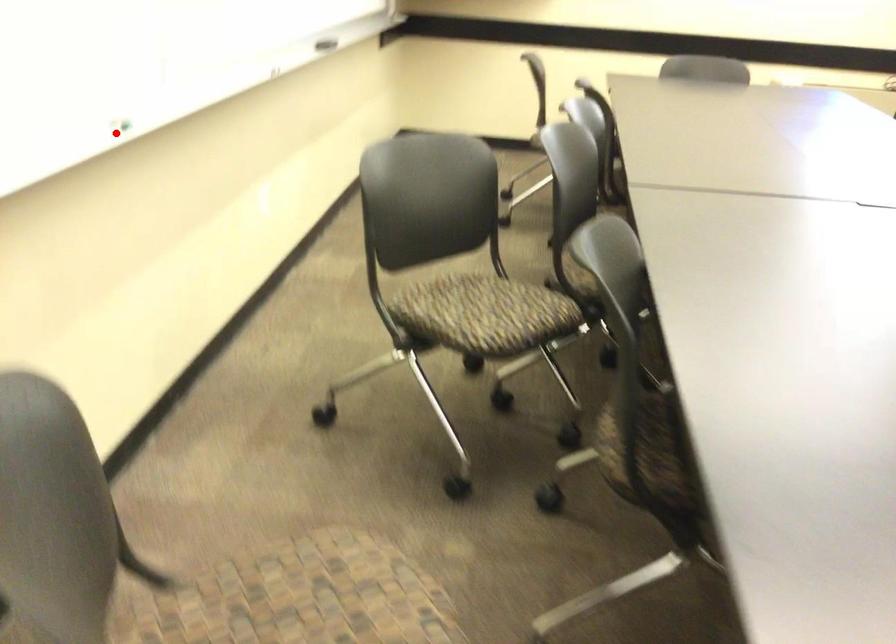
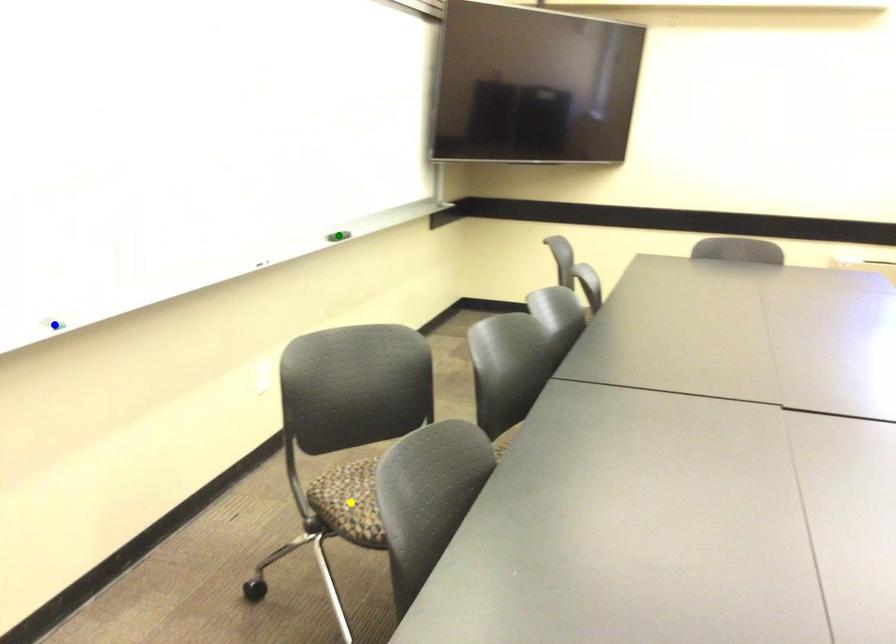
Question: I am providing you with two images of the same scene from different viewpoints. A red point is marked on the first image. You are given multiple points on the second image. Can you choose the point in image 2 that corresponds to the point in image 1?

Choices:
 (A) blue point
 (B) green point
 (C) yellow point

Answer: (A)